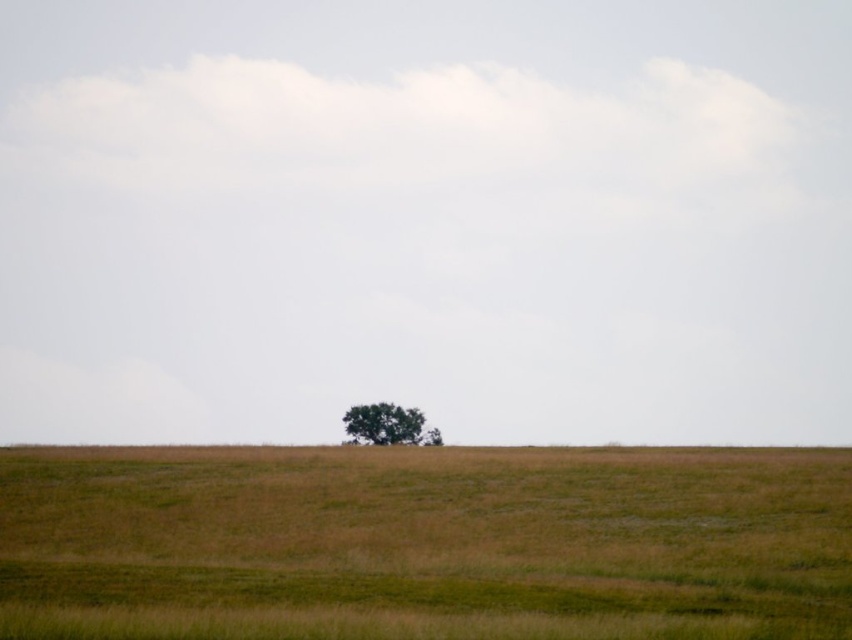
Question: Which of the following is the farthest from the observer?

Choices:
 (A) (711, 481)
 (B) (376, 417)

Answer: (B)

Question: Can you confirm if green grass at center is bigger than green leafy tree at center?

Choices:
 (A) yes
 (B) no

Answer: (A)

Question: Can you confirm if green grass at center is thinner than green leafy tree at center?

Choices:
 (A) yes
 (B) no

Answer: (B)

Question: Which point is farther to the camera?

Choices:
 (A) (406, 406)
 (B) (775, 632)

Answer: (A)

Question: Does green grass at center have a smaller size compared to green leafy tree at center?

Choices:
 (A) yes
 (B) no

Answer: (B)